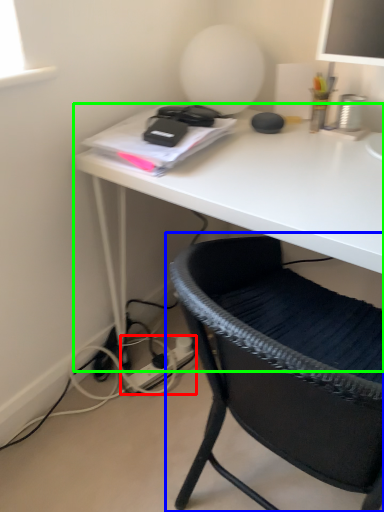
Question: Which is nearer to the plug (highlighted by a red box)? chair (highlighted by a blue box) or desk (highlighted by a green box).

Choices:
 (A) chair
 (B) desk

Answer: (B)